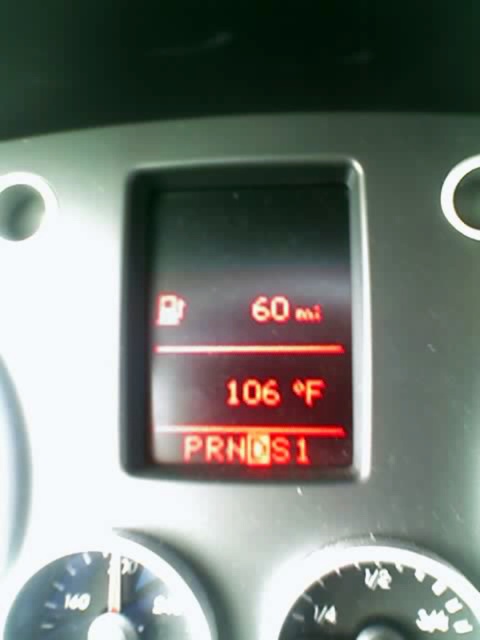
You are a driver checking your dashboard. You see the black glass speedometer at lower left and the transparent plastic gauge at lower right. Which one is located to the left?

The black glass speedometer at lower left is located to the left of the transparent plastic gauge at lower right.

You are a mechanic checking the dashboard of a car. You need to replace the black glass speedometer at lower left and the transparent plastic gauge at lower right. The new parts you have are 8 inches wide each. Will there be enough space between them to install both without overlapping?

The black glass speedometer at lower left and transparent plastic gauge at lower right are 8.22 inches apart from each other. Since each new part is 8 inches wide, the total required space would be 16 inches. However, the existing space between them is only 8.22 inches, which is insufficient. Therefore, installing both new parts without overlapping is not possible.

Consider the image. You are a driver checking your dashboard. You notice a point at coordinates point (108,596). Based on the scene description, what object is located at that point?

The point (108,596) indicates the black glass speedometer at lower left.